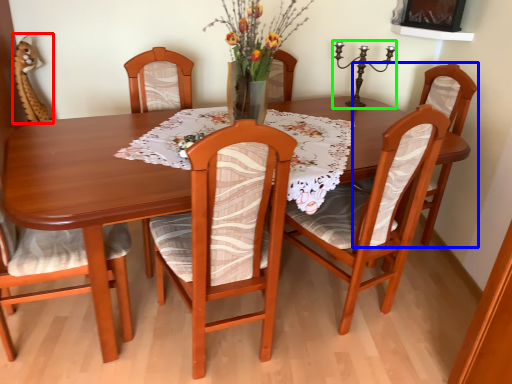
Question: Which object is positioned farthest from armchair (highlighted by a red box)? Select from chair (highlighted by a blue box) and candle holder (highlighted by a green box).

Choices:
 (A) chair
 (B) candle holder

Answer: (A)